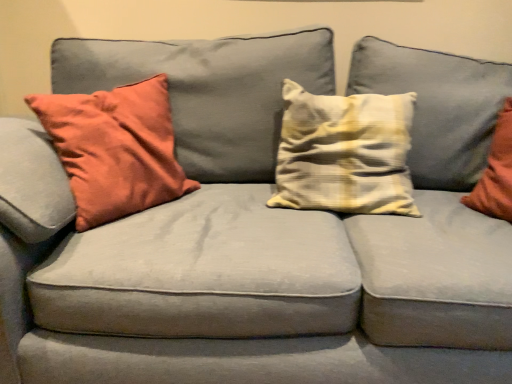
Describe the element at coordinates (115, 149) in the screenshot. I see `matte orange pillow at left, the second pillow when ordered from right to left` at that location.

Locate an element on the screen. matte orange pillow at left, which is counted as the 1th pillow, starting from the left is located at coordinates pyautogui.click(x=115, y=149).

The image size is (512, 384). What do you see at coordinates (344, 153) in the screenshot?
I see `yellow striped pillow at center, which is the 2th pillow from left to right` at bounding box center [344, 153].

Locate an element on the screen. The width and height of the screenshot is (512, 384). yellow striped pillow at center, which is the 1th pillow in right-to-left order is located at coordinates (344, 153).

Find the location of `matte orange pillow at left, which is counted as the 1th pillow, starting from the left`. matte orange pillow at left, which is counted as the 1th pillow, starting from the left is located at coordinates (115, 149).

From the picture: Between matte orange pillow at left, the second pillow when ordered from right to left, and yellow striped pillow at center, which is the 2th pillow from left to right, which one appears on the left side from the viewer's perspective?

From the viewer's perspective, matte orange pillow at left, the second pillow when ordered from right to left, appears more on the left side.

Is matte orange pillow at left, the second pillow when ordered from right to left, further to the viewer compared to yellow striped pillow at center, which is the 2th pillow from left to right?

No, the depth of matte orange pillow at left, the second pillow when ordered from right to left, is less than that of yellow striped pillow at center, which is the 2th pillow from left to right.

Which point is more forward, (120,97) or (388,167)?

The point (388,167) is closer to the camera.

From the image's perspective, which one is positioned lower, matte orange pillow at left, the second pillow when ordered from right to left, or yellow striped pillow at center, which is the 1th pillow in right-to-left order?

matte orange pillow at left, the second pillow when ordered from right to left, is shown below in the image.

From a real-world perspective, is matte orange pillow at left, which is counted as the 1th pillow, starting from the left, on top of yellow striped pillow at center, which is the 2th pillow from left to right?

No, from a real-world perspective, matte orange pillow at left, which is counted as the 1th pillow, starting from the left, is not on top of yellow striped pillow at center, which is the 2th pillow from left to right.

Does matte orange pillow at left, the second pillow when ordered from right to left, have a greater width compared to yellow striped pillow at center, which is the 1th pillow in right-to-left order?

Yes, matte orange pillow at left, the second pillow when ordered from right to left, is wider than yellow striped pillow at center, which is the 1th pillow in right-to-left order.

Is matte orange pillow at left, the second pillow when ordered from right to left, shorter than yellow striped pillow at center, which is the 2th pillow from left to right?

No, matte orange pillow at left, the second pillow when ordered from right to left, is not shorter than yellow striped pillow at center, which is the 2th pillow from left to right.

Is matte orange pillow at left, which is counted as the 1th pillow, starting from the left, bigger than yellow striped pillow at center, which is the 2th pillow from left to right?

Yes, matte orange pillow at left, which is counted as the 1th pillow, starting from the left, is bigger than yellow striped pillow at center, which is the 2th pillow from left to right.

Is matte orange pillow at left, the second pillow when ordered from right to left, outside of yellow striped pillow at center, which is the 2th pillow from left to right?

Yes.

Are matte orange pillow at left, which is counted as the 1th pillow, starting from the left, and yellow striped pillow at center, which is the 2th pillow from left to right, far apart?

No, there isn't a large distance between matte orange pillow at left, which is counted as the 1th pillow, starting from the left, and yellow striped pillow at center, which is the 2th pillow from left to right.

Consider the image. Is matte orange pillow at left, which is counted as the 1th pillow, starting from the left, facing away from yellow striped pillow at center, which is the 2th pillow from left to right?

That's not correct — matte orange pillow at left, which is counted as the 1th pillow, starting from the left, is not looking away from yellow striped pillow at center, which is the 2th pillow from left to right.

Can you tell me how much matte orange pillow at left, which is counted as the 1th pillow, starting from the left, and yellow striped pillow at center, which is the 1th pillow in right-to-left order, differ in facing direction?

57.3 degrees separate the facing orientations of matte orange pillow at left, which is counted as the 1th pillow, starting from the left, and yellow striped pillow at center, which is the 1th pillow in right-to-left order.

Measure the distance from matte orange pillow at left, which is counted as the 1th pillow, starting from the left, to yellow striped pillow at center, which is the 1th pillow in right-to-left order.

matte orange pillow at left, which is counted as the 1th pillow, starting from the left, and yellow striped pillow at center, which is the 1th pillow in right-to-left order, are 21.12 inches apart from each other.

Locate an element on the screen. Image resolution: width=512 pixels, height=384 pixels. pillow above the matte orange pillow at left, the second pillow when ordered from right to left (from the image's perspective) is located at coordinates (344, 153).

Can you confirm if yellow striped pillow at center, which is the 2th pillow from left to right, is positioned to the left of matte orange pillow at left, which is counted as the 1th pillow, starting from the left?

Incorrect, yellow striped pillow at center, which is the 2th pillow from left to right, is not on the left side of matte orange pillow at left, which is counted as the 1th pillow, starting from the left.

Is yellow striped pillow at center, which is the 2th pillow from left to right, in front of matte orange pillow at left, which is counted as the 1th pillow, starting from the left?

That is False.

Does point (380, 134) appear closer or farther from the camera than point (103, 129)?

Clearly, point (380, 134) is more distant from the camera than point (103, 129).

From the image's perspective, is yellow striped pillow at center, which is the 2th pillow from left to right, above or below matte orange pillow at left, which is counted as the 1th pillow, starting from the left?

yellow striped pillow at center, which is the 2th pillow from left to right, is above matte orange pillow at left, which is counted as the 1th pillow, starting from the left.

From the picture: From a real-world perspective, between yellow striped pillow at center, which is the 2th pillow from left to right, and matte orange pillow at left, which is counted as the 1th pillow, starting from the left, who is vertically higher?

yellow striped pillow at center, which is the 2th pillow from left to right.

In terms of width, does yellow striped pillow at center, which is the 1th pillow in right-to-left order, look wider or thinner when compared to matte orange pillow at left, the second pillow when ordered from right to left?

In the image, yellow striped pillow at center, which is the 1th pillow in right-to-left order, appears to be more narrow than matte orange pillow at left, the second pillow when ordered from right to left.

From their relative heights in the image, would you say yellow striped pillow at center, which is the 2th pillow from left to right, is taller or shorter than matte orange pillow at left, which is counted as the 1th pillow, starting from the left?

yellow striped pillow at center, which is the 2th pillow from left to right, is shorter than matte orange pillow at left, which is counted as the 1th pillow, starting from the left.

Considering the sizes of yellow striped pillow at center, which is the 1th pillow in right-to-left order, and matte orange pillow at left, which is counted as the 1th pillow, starting from the left, in the image, is yellow striped pillow at center, which is the 1th pillow in right-to-left order, bigger or smaller than matte orange pillow at left, which is counted as the 1th pillow, starting from the left,?

yellow striped pillow at center, which is the 1th pillow in right-to-left order, is smaller than matte orange pillow at left, which is counted as the 1th pillow, starting from the left.

Can we say yellow striped pillow at center, which is the 2th pillow from left to right, lies outside matte orange pillow at left, which is counted as the 1th pillow, starting from the left?

yellow striped pillow at center, which is the 2th pillow from left to right, lies outside matte orange pillow at left, which is counted as the 1th pillow, starting from the left,'s area.

Consider the image. Are yellow striped pillow at center, which is the 1th pillow in right-to-left order, and matte orange pillow at left, which is counted as the 1th pillow, starting from the left, making contact?

yellow striped pillow at center, which is the 1th pillow in right-to-left order, and matte orange pillow at left, which is counted as the 1th pillow, starting from the left, are not in contact.

Based on the photo, could you tell me if yellow striped pillow at center, which is the 1th pillow in right-to-left order, is turned towards matte orange pillow at left, which is counted as the 1th pillow, starting from the left?

No, yellow striped pillow at center, which is the 1th pillow in right-to-left order, does not turn towards matte orange pillow at left, which is counted as the 1th pillow, starting from the left.

I want to click on pillow that appears below the yellow striped pillow at center, which is the 2th pillow from left to right (from a real-world perspective), so click(x=115, y=149).

Locate an element on the screen. This screenshot has width=512, height=384. pillow lying in front of the yellow striped pillow at center, which is the 2th pillow from left to right is located at coordinates (115, 149).

There is a matte orange pillow at left, the second pillow when ordered from right to left. Where is `pillow above it (from a real-world perspective)`? This screenshot has width=512, height=384. pillow above it (from a real-world perspective) is located at coordinates (344, 153).